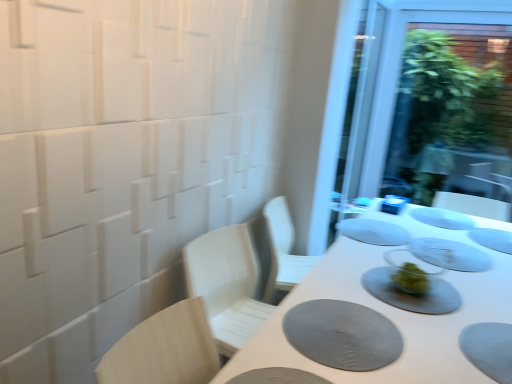
Identify the location of free area in between gray textured placemat at lower right and blue plastic container at center, which is the sixth tableware in front-to-back order. The image size is (512, 384). (368, 256).